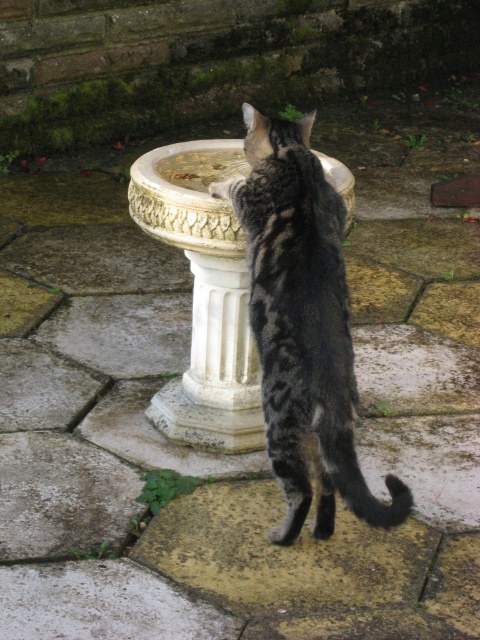
Who is positioned more to the left, tabby fur cat at center or white marble pillar at center?

white marble pillar at center is more to the left.

Between tabby fur cat at center and white marble pillar at center, which one has more height?

tabby fur cat at center

Looking at this image, who is more distant from viewer, (276, 540) or (204, 387)?

Point (204, 387)

Identify the location of tabby fur cat at center. This screenshot has height=640, width=480. (302, 326).